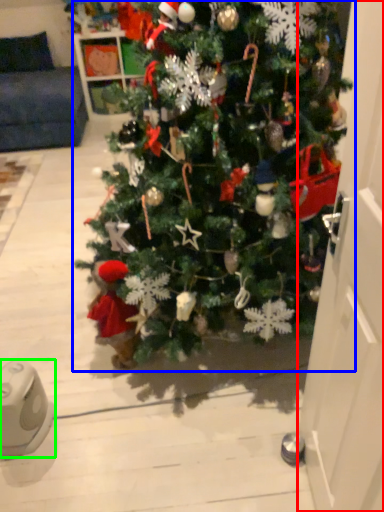
Question: Which object is positioned closest to door (highlighted by a red box)? Select from christmas tree (highlighted by a blue box) and ipod (highlighted by a green box).

Choices:
 (A) christmas tree
 (B) ipod

Answer: (A)